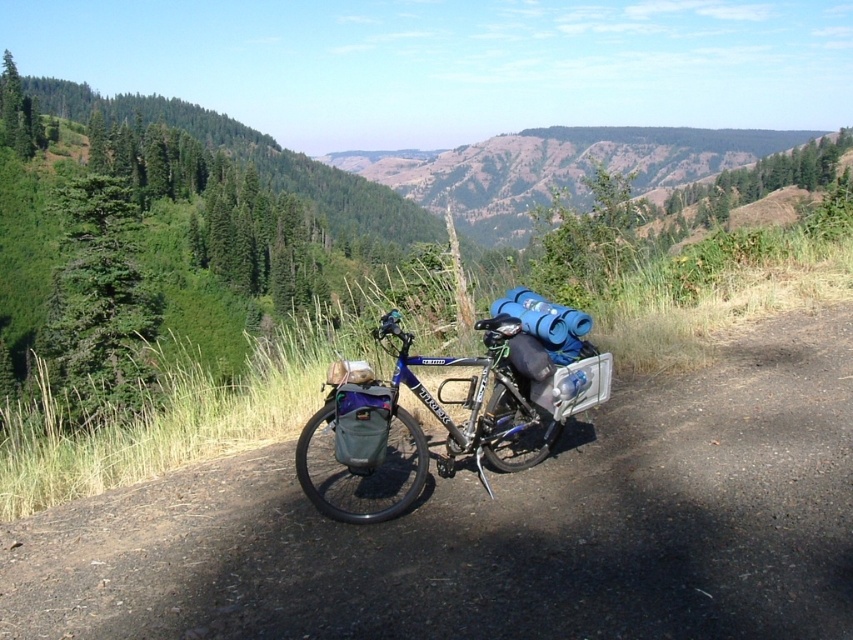
Question: Is dirt track at center to the left of blue metallic bicycle at center from the viewer's perspective?

Choices:
 (A) yes
 (B) no

Answer: (A)

Question: Which object is closer to the camera taking this photo?

Choices:
 (A) dirt track at center
 (B) blue metallic bicycle at center

Answer: (A)

Question: Which of the following is the farthest from the observer?

Choices:
 (A) (480, 445)
 (B) (705, 612)

Answer: (A)

Question: Can you confirm if dirt track at center is bigger than blue metallic bicycle at center?

Choices:
 (A) no
 (B) yes

Answer: (A)

Question: Which point appears closest to the camera in this image?

Choices:
 (A) (120, 554)
 (B) (502, 324)

Answer: (A)

Question: Is dirt track at center bigger than blue metallic bicycle at center?

Choices:
 (A) yes
 (B) no

Answer: (B)